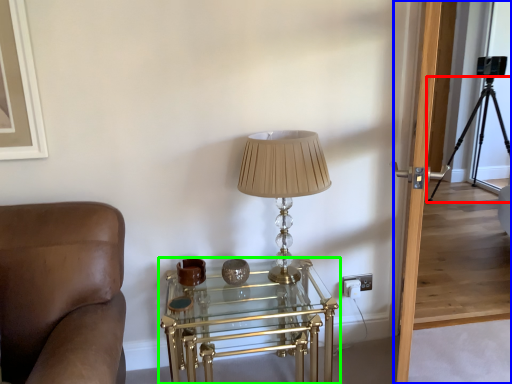
Question: Which is nearer to the tripod (highlighted by a red box)? glass door (highlighted by a blue box) or table (highlighted by a green box).

Choices:
 (A) glass door
 (B) table

Answer: (A)